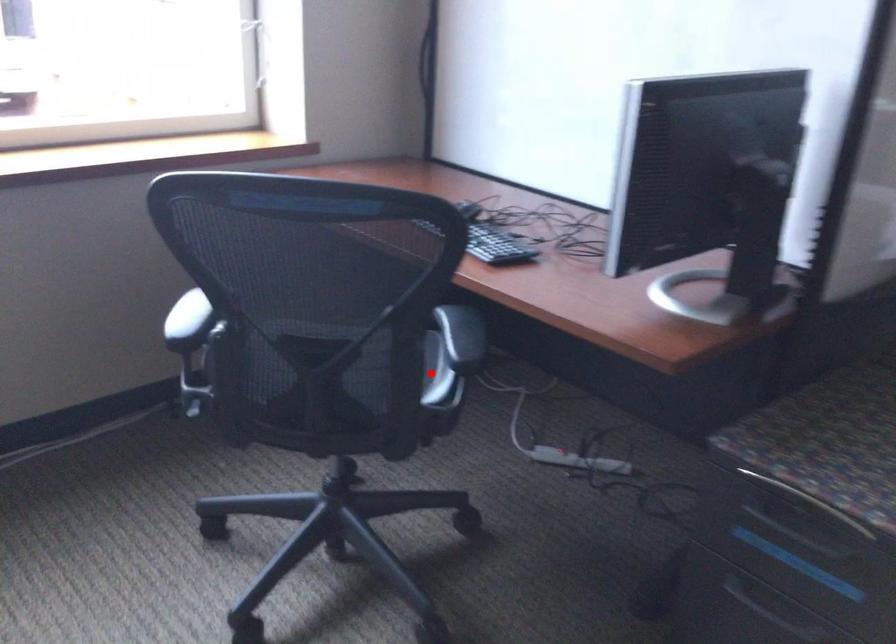
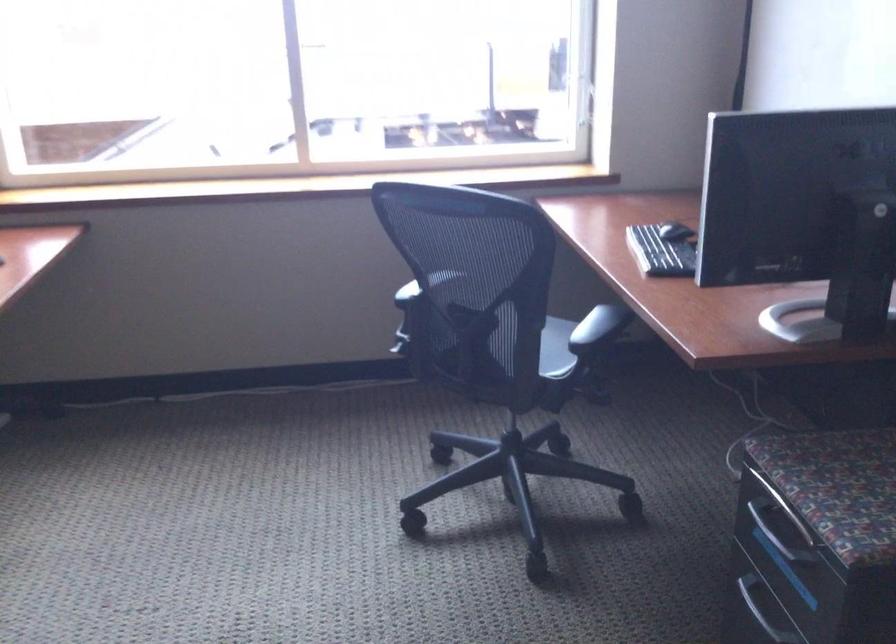
Question: I am providing you with two images of the same scene from different viewpoints. A red point is marked on the first image. Is the red point's position out of view in image 2?

Choices:
 (A) Yes
 (B) No

Answer: (B)